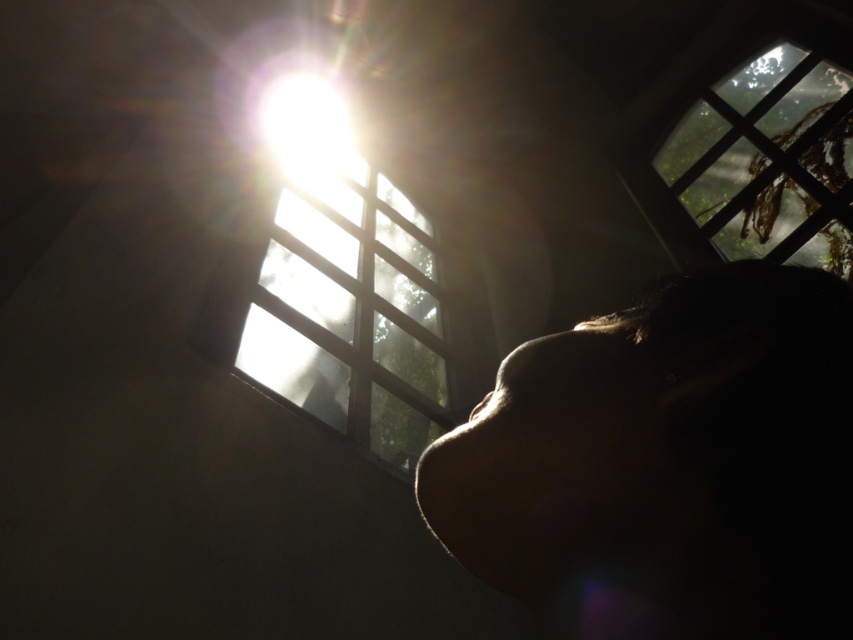
Which of these two, matte skin face at upper center or transparent glass window at upper center, stands shorter?

matte skin face at upper center

Between point (721, 294) and point (215, 291), which one is positioned behind?

Positioned behind is point (215, 291).

In order to click on matte skin face at upper center in this screenshot , I will do `click(666, 465)`.

Who is more distant from viewer, (x=308, y=193) or (x=784, y=202)?

The point (x=308, y=193) is behind.

Between point (456, 369) and point (849, 253), which one is positioned behind?

The point (456, 369) is more distant.

I want to click on transparent glass window at upper center, so (351, 316).

Between matte skin face at upper center and bright white light at upper center, which one appears on the left side from the viewer's perspective?

From the viewer's perspective, bright white light at upper center appears more on the left side.

Is matte skin face at upper center below bright white light at upper center?

Yes.

Is point (614, 438) more distant than point (300, 154)?

No.

Where is `matte skin face at upper center`? Image resolution: width=853 pixels, height=640 pixels. matte skin face at upper center is located at coordinates (666, 465).